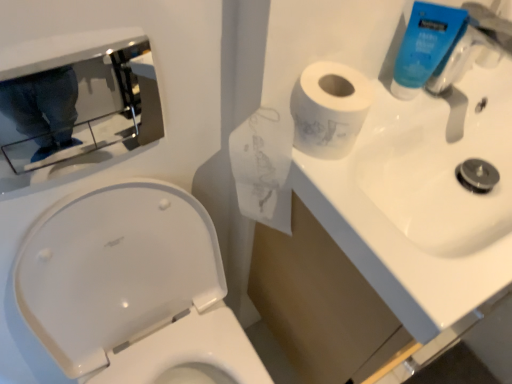
You are a GUI agent. You are given a task and a screenshot of the screen. Output one action in this format:
    pyautogui.click(x=<x>, y=<y>)
    Task: Click on the blue plastic faucet at upper right
    The image size is (512, 384).
    Given the screenshot: What is the action you would take?
    pyautogui.click(x=473, y=46)

Measure the distance between blue plastic faucet at upper right and camera.

A distance of 26.34 inches exists between blue plastic faucet at upper right and camera.

Find the location of a particular element. The width and height of the screenshot is (512, 384). polished chrome mirror at upper left is located at coordinates (91, 93).

The image size is (512, 384). I want to click on blue plastic tube at upper right, so click(424, 46).

Identify the location of blue plastic faucet at upper right. The width and height of the screenshot is (512, 384). (473, 46).

Is point (440, 21) less distant than point (94, 313)?

Yes, point (440, 21) is closer to viewer.

From the image's perspective, which one is positioned higher, blue plastic tube at upper right or white glossy toilet at lower left?

blue plastic tube at upper right, from the image's perspective.

Considering the relative positions of blue plastic tube at upper right and white glossy toilet at lower left in the image provided, is blue plastic tube at upper right to the right of white glossy toilet at lower left from the viewer's perspective?

Indeed, blue plastic tube at upper right is positioned on the right side of white glossy toilet at lower left.

What are the coordinates of `toilet located below the polished chrome mirror at upper left (from the image's perspective)` in the screenshot? It's located at (128, 292).

From a real-world perspective, which is physically below, polished chrome mirror at upper left or white glossy toilet at lower left?

From a 3D spatial view, white glossy toilet at lower left is below.

Considering the sizes of polished chrome mirror at upper left and white glossy toilet at lower left in the image, is polished chrome mirror at upper left taller or shorter than white glossy toilet at lower left?

Considering their sizes, polished chrome mirror at upper left has less height than white glossy toilet at lower left.

Does point (99, 67) lie in front of point (114, 334)?

No.

Between white glossy toilet at lower left and polished chrome mirror at upper left, which one has more height?

Standing taller between the two is white glossy toilet at lower left.

Between white glossy toilet at lower left and polished chrome mirror at upper left, which one has larger width?

white glossy toilet at lower left is wider.

Is white glossy toilet at lower left closer to the viewer compared to polished chrome mirror at upper left?

That is True.

Consider the image. From a real-world perspective, between white glossy toilet at lower left and polished chrome mirror at upper left, who is vertically lower?

white glossy toilet at lower left is physically lower.

In terms of height, does polished chrome mirror at upper left look taller or shorter compared to blue plastic tube at upper right?

Considering their sizes, polished chrome mirror at upper left has more height than blue plastic tube at upper right.

Does polished chrome mirror at upper left have a smaller size compared to blue plastic tube at upper right?

No.

From a real-world perspective, between polished chrome mirror at upper left and blue plastic tube at upper right, who is vertically higher?

blue plastic tube at upper right, from a real-world perspective.

How far apart are polished chrome mirror at upper left and blue plastic tube at upper right?

A distance of 22.53 inches exists between polished chrome mirror at upper left and blue plastic tube at upper right.

Is polished chrome mirror at upper left touching blue plastic faucet at upper right?

No, polished chrome mirror at upper left is not with blue plastic faucet at upper right.

Considering the relative sizes of polished chrome mirror at upper left and blue plastic faucet at upper right in the image provided, is polished chrome mirror at upper left shorter than blue plastic faucet at upper right?

In fact, polished chrome mirror at upper left may be taller than blue plastic faucet at upper right.

Could blue plastic faucet at upper right be considered to be inside polished chrome mirror at upper left?

Definitely not — blue plastic faucet at upper right is not inside polished chrome mirror at upper left.

Is blue plastic faucet at upper right at the right side of white glossy toilet at lower left?

Yes, blue plastic faucet at upper right is to the right of white glossy toilet at lower left.

Does blue plastic faucet at upper right lie in front of white glossy toilet at lower left?

No, it is behind white glossy toilet at lower left.

Considering the sizes of objects blue plastic faucet at upper right and white glossy toilet at lower left in the image provided, who is wider, blue plastic faucet at upper right or white glossy toilet at lower left?

white glossy toilet at lower left.

Is blue plastic faucet at upper right positioned far away from white glossy toilet at lower left?

blue plastic faucet at upper right is actually quite close to white glossy toilet at lower left.

Considering their positions, is polished chrome mirror at upper left located in front of or behind white glossy sink at upper right?

In the image, polished chrome mirror at upper left appears in front of white glossy sink at upper right.

Is white glossy sink at upper right inside polished chrome mirror at upper left?

No, white glossy sink at upper right is located outside of polished chrome mirror at upper left.

Between polished chrome mirror at upper left and white glossy sink at upper right, which one has larger width?

white glossy sink at upper right is wider.

Find the location of a particular element. The width and height of the screenshot is (512, 384). toilet located in front of the blue plastic tube at upper right is located at coordinates (128, 292).

You are a GUI agent. You are given a task and a screenshot of the screen. Output one action in this format:
    pyautogui.click(x=<x>, y=<y>)
    Task: Click on the toilet below the polished chrome mirror at upper left (from the image's perspective)
    The width and height of the screenshot is (512, 384).
    Given the screenshot: What is the action you would take?
    pyautogui.click(x=128, y=292)

In the scene shown: Looking at the image, which one is located further to polished chrome mirror at upper left, white glossy toilet at lower left or white glossy sink at upper right?

white glossy sink at upper right.

Based on their spatial positions, is polished chrome mirror at upper left or white glossy toilet at lower left further from blue plastic faucet at upper right?

Based on the image, white glossy toilet at lower left appears to be further to blue plastic faucet at upper right.

When comparing their distances from white glossy toilet at lower left, does white glossy sink at upper right or blue plastic tube at upper right seem closer?

Based on the image, white glossy sink at upper right appears to be nearer to white glossy toilet at lower left.

Considering their positions, is blue plastic faucet at upper right positioned further to white glossy sink at upper right than polished chrome mirror at upper left?

polished chrome mirror at upper left is further to white glossy sink at upper right.

Estimate the real-world distances between objects in this image. Which object is further from polished chrome mirror at upper left, white glossy sink at upper right or white glossy toilet at lower left?

white glossy sink at upper right is further to polished chrome mirror at upper left.

When comparing their distances from white glossy sink at upper right, does white glossy toilet at lower left or blue plastic faucet at upper right seem closer?

blue plastic faucet at upper right is closer to white glossy sink at upper right.

From the image, which object appears to be nearer to blue plastic tube at upper right, white glossy sink at upper right or blue plastic faucet at upper right?

blue plastic faucet at upper right.

When comparing their distances from blue plastic tube at upper right, does blue plastic faucet at upper right or white glossy sink at upper right seem closer?

blue plastic faucet at upper right is closer to blue plastic tube at upper right.

Where is `faucet that lies between blue plastic tube at upper right and white glossy toilet at lower left from top to bottom`? The image size is (512, 384). faucet that lies between blue plastic tube at upper right and white glossy toilet at lower left from top to bottom is located at coordinates (473, 46).

Locate an element on the screen. toilet situated between polished chrome mirror at upper left and blue plastic faucet at upper right from left to right is located at coordinates 128,292.

The image size is (512, 384). Identify the location of faucet located between polished chrome mirror at upper left and white glossy sink at upper right in the left-right direction. (473, 46).

Find the location of `cleaning product between polished chrome mirror at upper left and white glossy sink at upper right from left to right`. cleaning product between polished chrome mirror at upper left and white glossy sink at upper right from left to right is located at coordinates (424, 46).